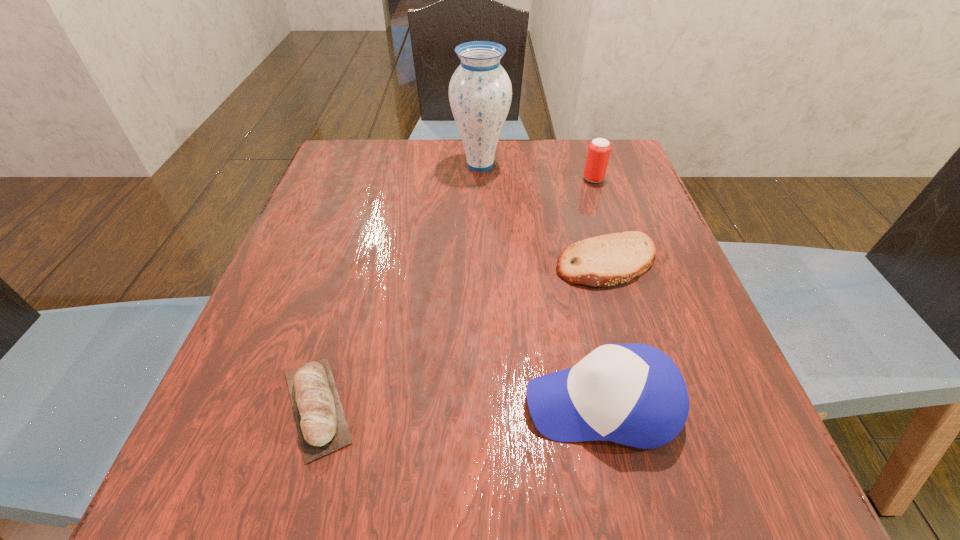
Where is `vase`? This screenshot has height=540, width=960. vase is located at coordinates (480, 92).

At what (x,y) coordinates should I click in order to perform the action: click on beer can. Please return your answer as a coordinate pair (x, y). The width and height of the screenshot is (960, 540). Looking at the image, I should click on (599, 149).

Identify the location of baseball cap. The image size is (960, 540). (633, 394).

Where is `the nearer pita bread`? The height and width of the screenshot is (540, 960). the nearer pita bread is located at coordinates (322, 427).

Where is `the left pita bread`? the left pita bread is located at coordinates (322, 427).

I want to click on the right pita bread, so click(x=607, y=260).

Locate an element on the screen. The width and height of the screenshot is (960, 540). the third farthest object is located at coordinates (607, 260).

Find the location of a particular element. This screenshot has width=960, height=540. vacant space located on the left of the vase is located at coordinates (365, 165).

This screenshot has width=960, height=540. Identify the location of free region located on the front of the beer can. (609, 224).

The width and height of the screenshot is (960, 540). What are the coordinates of `free spot located on the front-facing side of the baseball cap` in the screenshot? It's located at (265, 404).